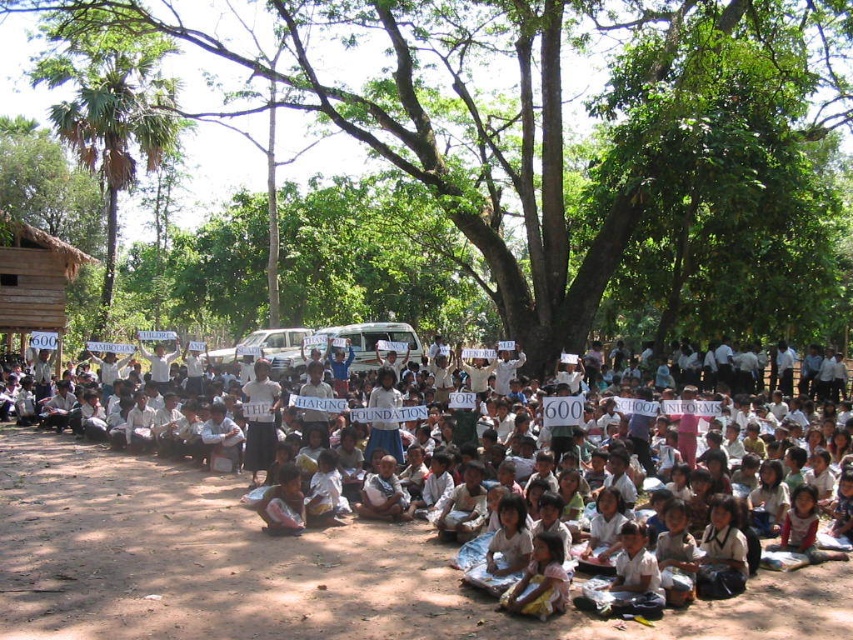
Question: Estimate the real-world distances between objects in this image. Which object is farther from the green leafy tree at center?

Choices:
 (A) green leafy tree at upper left
 (B) white cloth sign at center

Answer: (B)

Question: Observing the image, what is the correct spatial positioning of green leafy tree at center in reference to white cloth sign at center?

Choices:
 (A) right
 (B) left

Answer: (B)

Question: Estimate the real-world distances between objects in this image. Which object is farther from the white cloth sign at center?

Choices:
 (A) green leafy tree at upper left
 (B) green leafy tree at center

Answer: (B)

Question: Can you confirm if green leafy tree at center is positioned above green leafy tree at upper left?

Choices:
 (A) no
 (B) yes

Answer: (B)

Question: Is green leafy tree at center thinner than white cloth sign at center?

Choices:
 (A) yes
 (B) no

Answer: (B)

Question: Among these points, which one is farthest from the camera?

Choices:
 (A) (140, 19)
 (B) (42, 621)

Answer: (A)